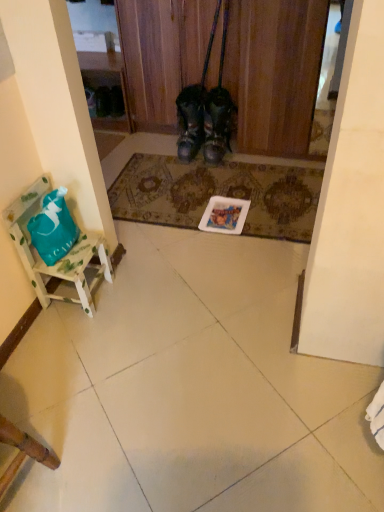
You are a GUI agent. You are given a task and a screenshot of the screen. Output one action in this format:
    pyautogui.click(x=<x>, y=<y>)
    Task: Click on the blank space to the left of leather boots at center, which is the second footwear from left to right
    This screenshot has width=384, height=512.
    Given the screenshot: What is the action you would take?
    pyautogui.click(x=184, y=161)